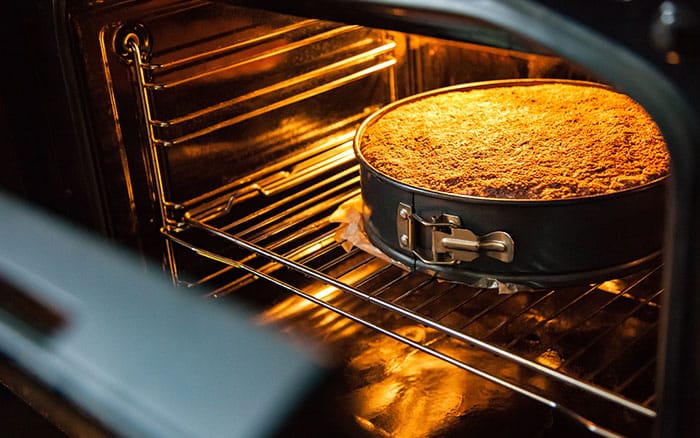
This screenshot has height=438, width=700. I want to click on inside wall of oven, so click(x=122, y=134).